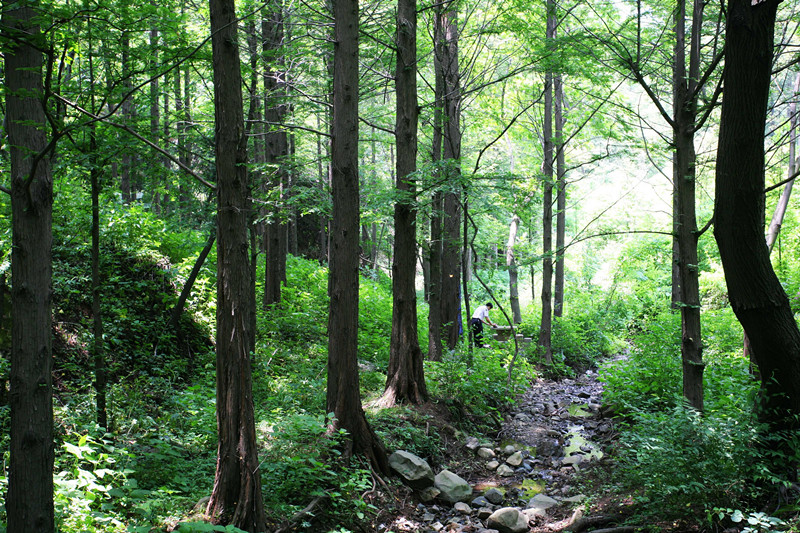
Where is `bench`? bench is located at coordinates (505, 331).